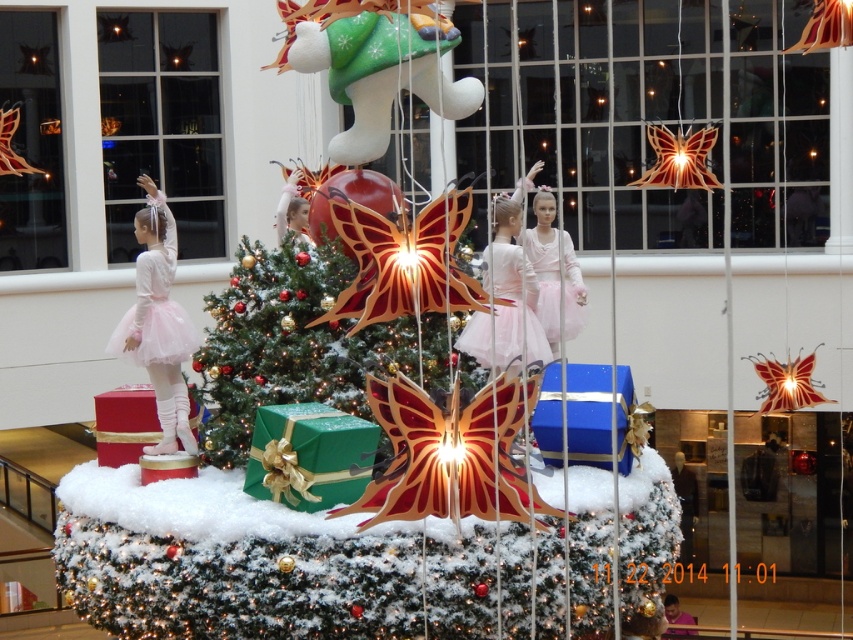
Question: Does pink tulle ballet dancer at upper left appear over pink satin doll at center?

Choices:
 (A) no
 (B) yes

Answer: (B)

Question: Which object appears farthest from the camera in this image?

Choices:
 (A) green paper christmas tree at center
 (B) pink tulle ballet dancer at upper left

Answer: (B)

Question: Which of the following is the closest to the observer?

Choices:
 (A) matte paper butterfly at upper center
 (B) pink tulle ballet dancer at upper left

Answer: (A)

Question: Does pink tulle ballet dancer at upper left appear on the right side of pink satin doll at center?

Choices:
 (A) no
 (B) yes

Answer: (A)

Question: Which object is the closest to the pink satin tutu at center?

Choices:
 (A) pink tulle skirt at left
 (B) pink satin doll at center
 (C) green paper christmas tree at center

Answer: (B)

Question: Is pink satin tutu at center smaller than pink satin doll at center?

Choices:
 (A) no
 (B) yes

Answer: (A)